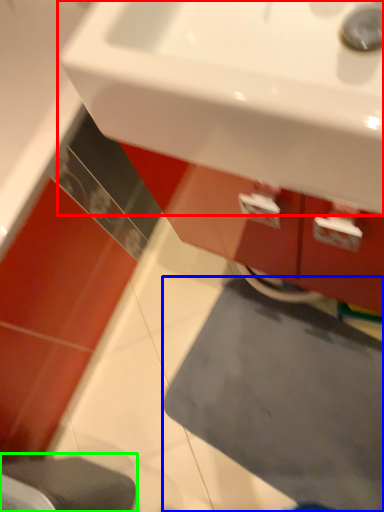
Question: Which is farther away from sink (highlighted by a red box)? bath mat (highlighted by a blue box) or step stool (highlighted by a green box)?

Choices:
 (A) bath mat
 (B) step stool

Answer: (A)